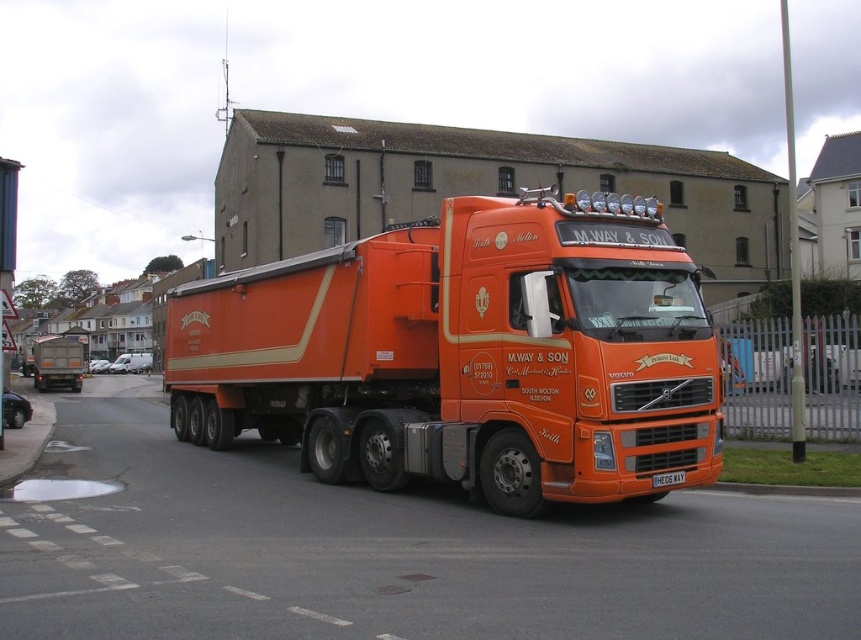
The image size is (861, 640). Describe the element at coordinates (466, 355) in the screenshot. I see `orange matte trailer truck at center` at that location.

Between orange matte trailer truck at center and white plastic license plate at center, which one appears on the right side from the viewer's perspective?

Positioned to the right is orange matte trailer truck at center.

Measure the distance between orange matte trailer truck at center and camera.

8.21 meters

Identify the location of orange matte trailer truck at center. (466, 355).

Does point (401, 365) lie in front of point (54, 381)?

Yes, it is.

Does orange matte trailer truck at center lie behind orange matte truck at center?

No, orange matte trailer truck at center is in front of orange matte truck at center.

At what (x,y) coordinates should I click in order to perform the action: click on orange matte trailer truck at center. Please return your answer as a coordinate pair (x, y). This screenshot has width=861, height=640. Looking at the image, I should click on (466, 355).

Is orange matte truck at center taller than white plastic license plate at center?

Indeed, orange matte truck at center has a greater height compared to white plastic license plate at center.

Is point (42, 371) positioned before point (663, 476)?

No.

Between point (38, 368) and point (661, 483), which one is positioned behind?

The point (38, 368) is more distant.

What are the coordinates of `orange matte truck at center` in the screenshot? It's located at (59, 362).